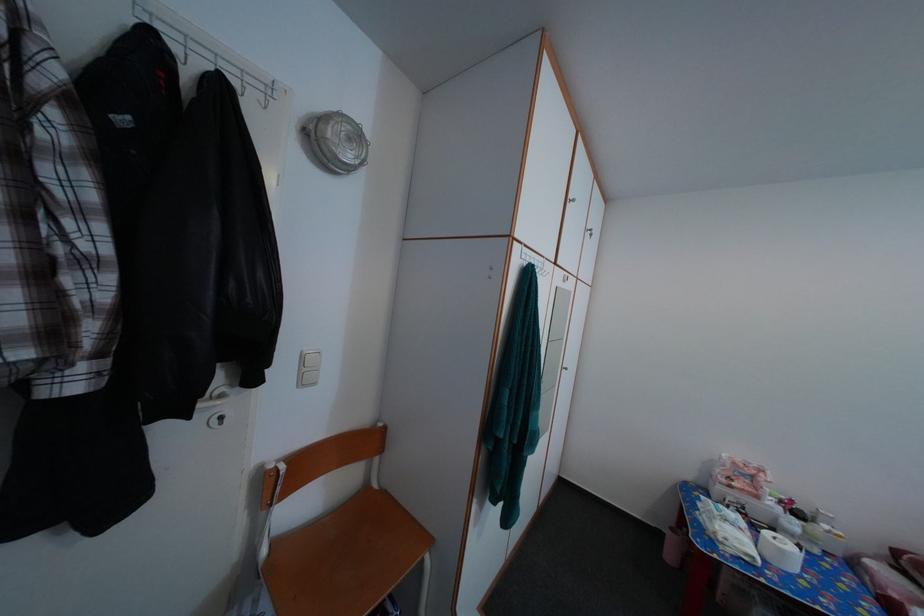
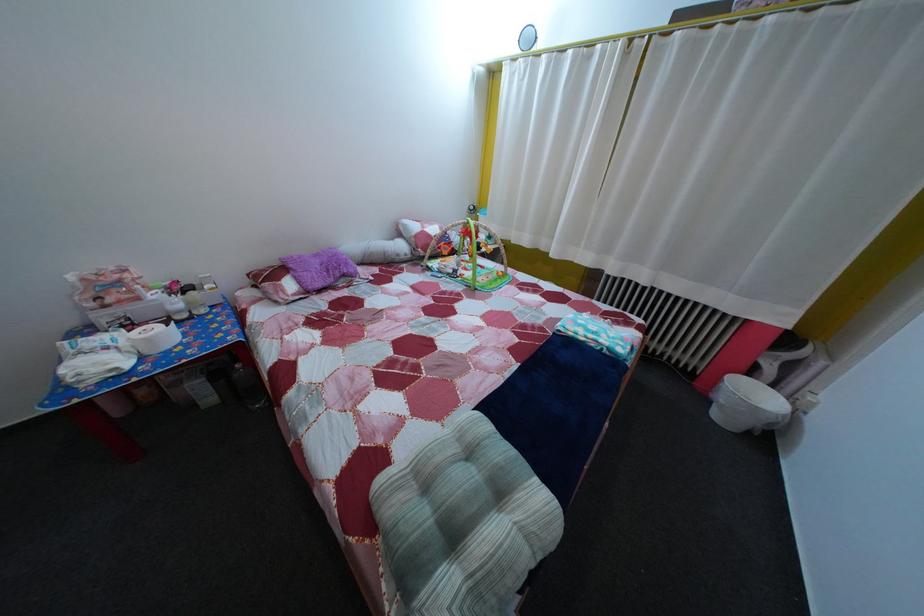
Based on the continuous images, in which direction is the camera rotating?

The camera's rotation is toward right-down.